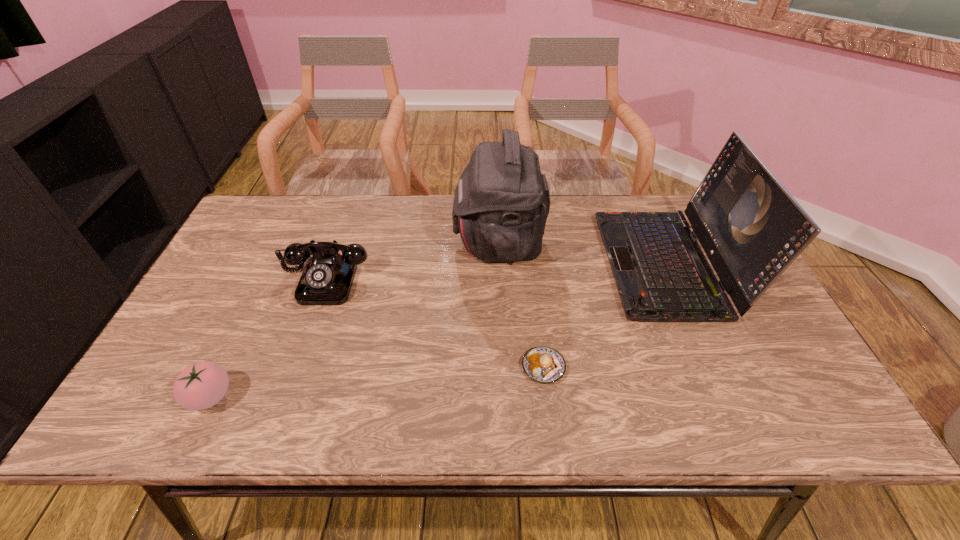
In order to click on free spot located on the screen of the rightmost object in this screenshot , I will do `click(569, 264)`.

Find the location of a particular element. The width and height of the screenshot is (960, 540). vacant space situated 0.280m on the dial of the telephone is located at coordinates (282, 403).

In order to click on free space located on the right of the tomato in this screenshot , I will do `click(344, 396)`.

I want to click on vacant region located on the left of the pastry, so click(x=365, y=367).

Where is `shoulder bag at the far edge`? Image resolution: width=960 pixels, height=540 pixels. shoulder bag at the far edge is located at coordinates 501,203.

Locate an element on the screen. The image size is (960, 540). laptop computer located in the far edge section of the desktop is located at coordinates (751, 228).

The image size is (960, 540). Find the location of `object located in the near edge section of the desktop`. object located in the near edge section of the desktop is located at coordinates (201, 385).

Locate an element on the screen. object that is at the left edge is located at coordinates (201, 385).

At what (x,y) coordinates should I click in order to perform the action: click on object that is positioned at the right edge. Please return your answer as a coordinate pair (x, y). Image resolution: width=960 pixels, height=540 pixels. Looking at the image, I should click on (751, 228).

Where is `object located in the near left corner section of the desktop`? This screenshot has height=540, width=960. object located in the near left corner section of the desktop is located at coordinates (201, 385).